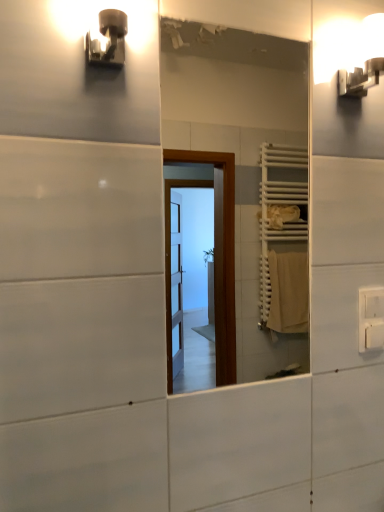
Question: Can you confirm if metallic wall sconce at upper left, which is the 2th light fixture from back to front, is wider than white glossy wall sconce at upper right, acting as the second light fixture starting from the front?

Choices:
 (A) no
 (B) yes

Answer: (A)

Question: Does metallic wall sconce at upper left, the 1th light fixture viewed from the front, lie in front of white glossy wall sconce at upper right, arranged as the 1th light fixture when viewed from the back?

Choices:
 (A) yes
 (B) no

Answer: (A)

Question: From the image's perspective, would you say metallic wall sconce at upper left, the second light fixture positioned from the right, is positioned over white glossy wall sconce at upper right, arranged as the 1th light fixture when viewed from the back?

Choices:
 (A) no
 (B) yes

Answer: (A)

Question: Is metallic wall sconce at upper left, which appears as the first light fixture when viewed from the left, thinner than white glossy wall sconce at upper right, the second light fixture viewed from the left?

Choices:
 (A) no
 (B) yes

Answer: (B)

Question: From a real-world perspective, is metallic wall sconce at upper left, the second light fixture positioned from the right, positioned over white glossy wall sconce at upper right, acting as the second light fixture starting from the front, based on gravity?

Choices:
 (A) no
 (B) yes

Answer: (A)

Question: Is metallic wall sconce at upper left, which is the 2th light fixture from back to front, outside white glossy wall sconce at upper right, acting as the second light fixture starting from the front?

Choices:
 (A) yes
 (B) no

Answer: (A)

Question: Is the position of white plastic electric outlet at upper right less distant than that of metallic wall sconce at upper left, which is the 2th light fixture from back to front?

Choices:
 (A) yes
 (B) no

Answer: (B)

Question: Does white plastic electric outlet at upper right have a greater width compared to metallic wall sconce at upper left, the 1th light fixture viewed from the front?

Choices:
 (A) yes
 (B) no

Answer: (B)

Question: Does white plastic electric outlet at upper right appear on the left side of metallic wall sconce at upper left, which is the 2th light fixture from back to front?

Choices:
 (A) yes
 (B) no

Answer: (B)

Question: Considering the relative positions of white plastic electric outlet at upper right and metallic wall sconce at upper left, the second light fixture positioned from the right, in the image provided, is white plastic electric outlet at upper right to the right of metallic wall sconce at upper left, the second light fixture positioned from the right, from the viewer's perspective?

Choices:
 (A) yes
 (B) no

Answer: (A)

Question: Would you say white plastic electric outlet at upper right is outside metallic wall sconce at upper left, the second light fixture positioned from the right?

Choices:
 (A) no
 (B) yes

Answer: (B)

Question: Does white plastic electric outlet at upper right have a larger size compared to metallic wall sconce at upper left, the second light fixture positioned from the right?

Choices:
 (A) yes
 (B) no

Answer: (B)

Question: Does metallic wall sconce at upper left, which is the 2th light fixture from back to front, have a greater height compared to white plastic electric outlet at upper right?

Choices:
 (A) yes
 (B) no

Answer: (B)